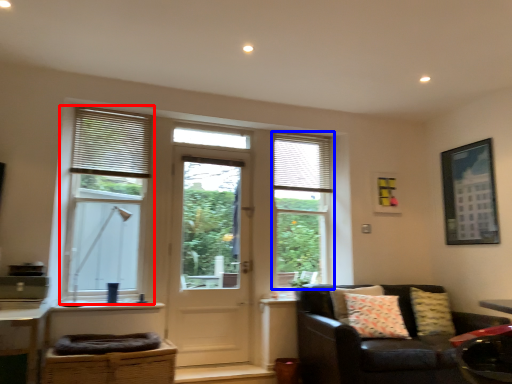
Question: Which object is closer to the camera taking this photo, window (highlighted by a red box) or window (highlighted by a blue box)?

Choices:
 (A) window
 (B) window

Answer: (A)